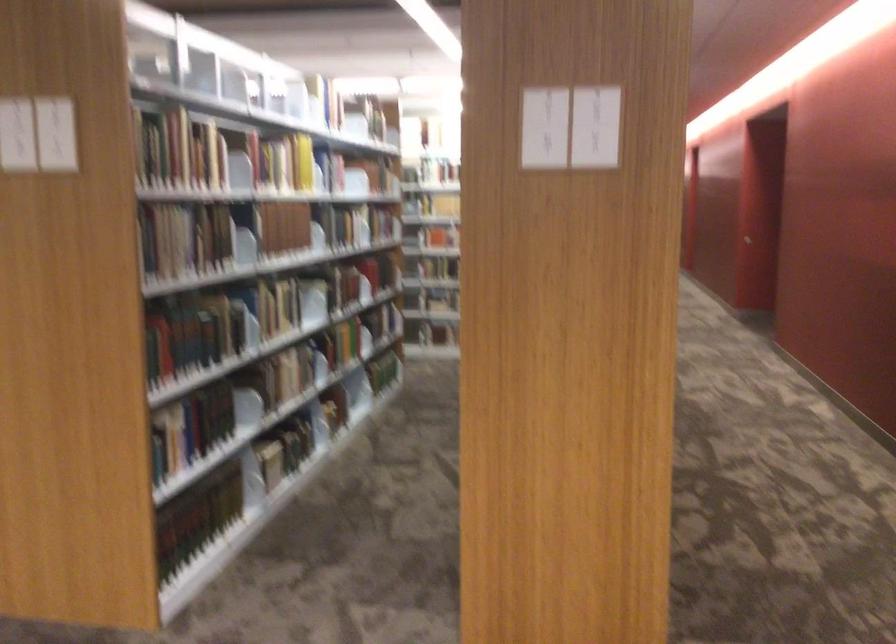
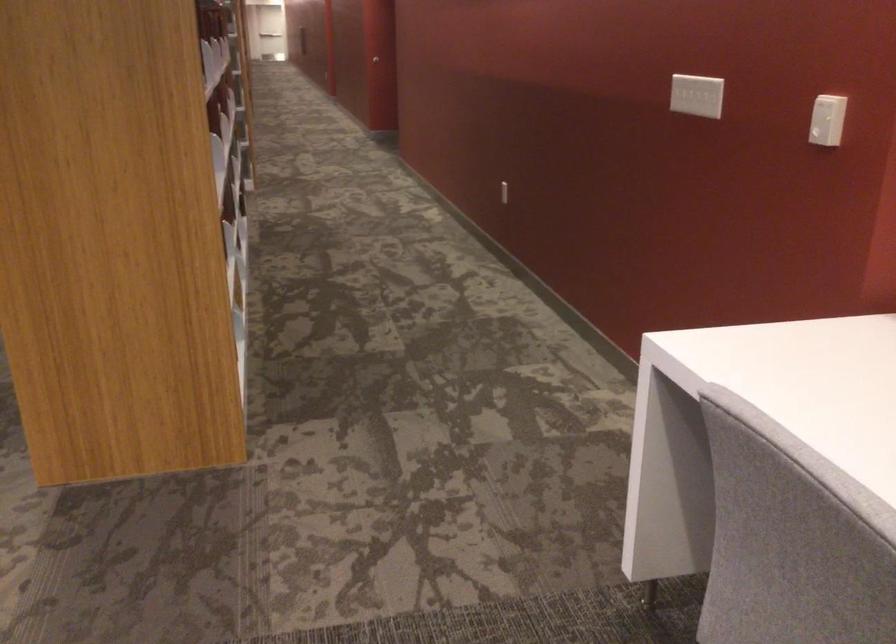
Question: The camera is either moving clockwise (left) or counter-clockwise (right) around the object. The first image is from the beginning of the video and the second image is from the end. Is the camera moving left or right when shooting the video?

Choices:
 (A) Left
 (B) Right

Answer: (A)